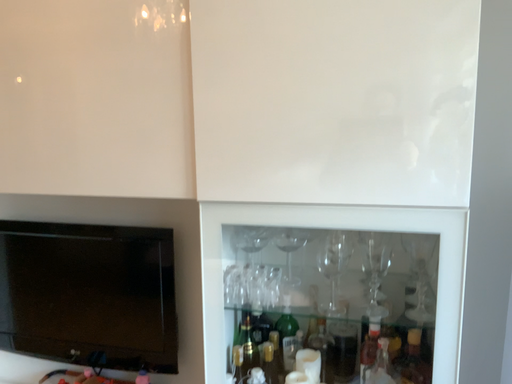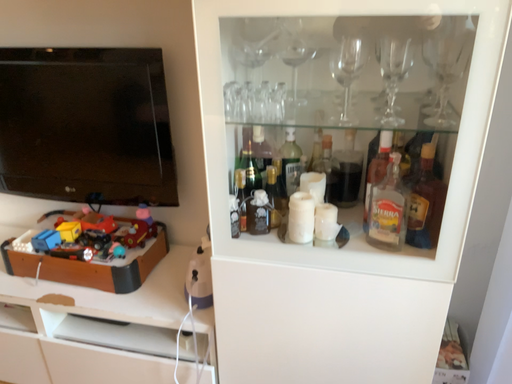
Question: How did the camera likely rotate when shooting the video?

Choices:
 (A) rotated downward
 (B) rotated upward

Answer: (A)